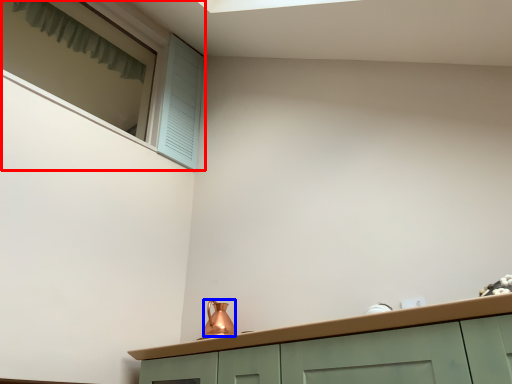
Question: Which object appears farthest to the camera in this image, window (highlighted by a red box) or tea pot (highlighted by a blue box)?

Choices:
 (A) window
 (B) tea pot

Answer: (A)